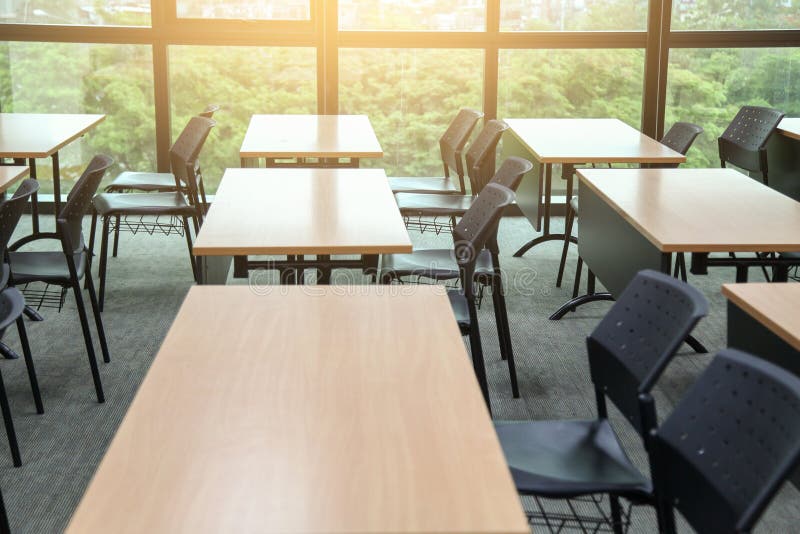
Locate an element on the screen. The height and width of the screenshot is (534, 800). glass panes is located at coordinates (66, 10), (70, 65), (246, 70), (253, 7), (396, 18), (390, 74), (574, 72), (569, 10), (716, 15), (712, 84).